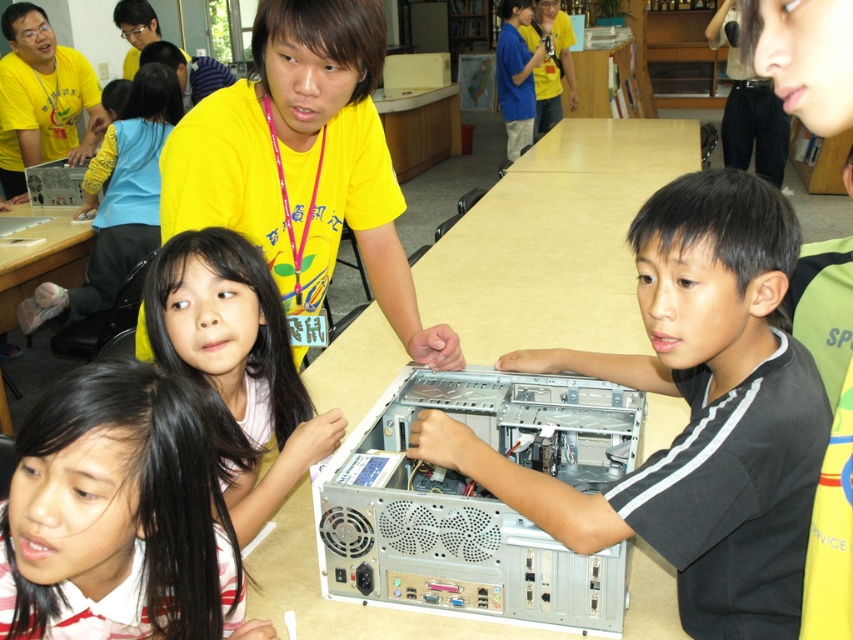
Can you confirm if matte yellow shirt at center is thinner than blue/yellow shirt at upper center?

Indeed, matte yellow shirt at center has a lesser width compared to blue/yellow shirt at upper center.

The image size is (853, 640). Describe the element at coordinates (236, 364) in the screenshot. I see `matte yellow shirt at center` at that location.

Who is more forward, (288, 440) or (515, 81)?

Point (288, 440) is in front.

Identify the location of matte yellow shirt at center. The width and height of the screenshot is (853, 640). (236, 364).

From the picture: Can you confirm if silver metallic computer at center is smaller than blue/yellow shirt at upper center?

Yes.

Who is more distant from viewer, [578,467] or [525,96]?

The point [525,96] is behind.

Which is behind, point (387, 525) or point (498, 35)?

The point (498, 35) is behind.

This screenshot has width=853, height=640. Find the location of `silver metallic computer at center`. silver metallic computer at center is located at coordinates (477, 500).

Who is positioned more to the left, striped fabric shirt at lower left or blue/yellow shirt at upper center?

From the viewer's perspective, striped fabric shirt at lower left appears more on the left side.

Does striped fabric shirt at lower left have a greater width compared to blue/yellow shirt at upper center?

No.

This screenshot has width=853, height=640. Identify the location of striped fabric shirt at lower left. (125, 506).

Locate an element on the screen. This screenshot has width=853, height=640. striped fabric shirt at lower left is located at coordinates (125, 506).